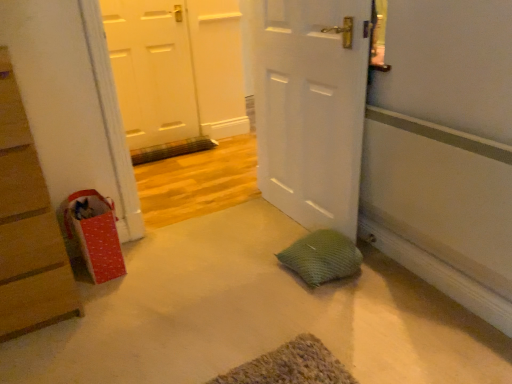
Question: Considering the positions of red cardboard chest of drawers at left and red dotted paper bag at left in the image, is red cardboard chest of drawers at left taller or shorter than red dotted paper bag at left?

Choices:
 (A) short
 (B) tall

Answer: (B)

Question: Does point click(x=25, y=135) appear closer or farther from the camera than point click(x=95, y=243)?

Choices:
 (A) closer
 (B) farther

Answer: (A)

Question: Which of these objects is positioned closest to the white matte door at upper left, which is counted as the second door, starting from the right?

Choices:
 (A) white matte door at center, which appears as the 2th door when viewed from the back
 (B) green mesh pillow at center
 (C) red cardboard chest of drawers at left
 (D) red dotted paper bag at left
 (E) wooden vent at center

Answer: (E)

Question: Estimate the real-world distances between objects in this image. Which object is farther from the wooden vent at center?

Choices:
 (A) white matte door at center, which ranks as the 1th door in right-to-left order
 (B) red cardboard chest of drawers at left
 (C) white matte door at upper left, acting as the first door starting from the back
 (D) red dotted paper bag at left
 (E) green mesh pillow at center

Answer: (B)